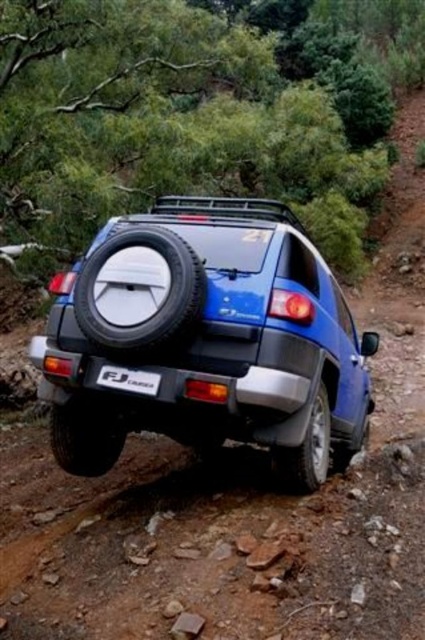
From the picture: Between blue matte suv at center and black rubber tire at lower left, which one is positioned lower?

Positioned lower is black rubber tire at lower left.

Locate an element on the screen. The width and height of the screenshot is (425, 640). blue matte suv at center is located at coordinates (206, 339).

Is point (118, 224) closer to viewer compared to point (96, 412)?

No.

You are a GUI agent. You are given a task and a screenshot of the screen. Output one action in this format:
    pyautogui.click(x=<x>, y=<y>)
    Task: Click on the blue matte suv at center
    
    Given the screenshot: What is the action you would take?
    pyautogui.click(x=206, y=339)

Describe the element at coordinates (85, 436) in the screenshot. I see `black rubber tire at lower left` at that location.

Does black rubber tire at lower left have a greater height compared to black rubber tire at lower right?

In fact, black rubber tire at lower left may be shorter than black rubber tire at lower right.

Where is `black rubber tire at lower left`? The image size is (425, 640). black rubber tire at lower left is located at coordinates (85, 436).

Based on the photo, does black rubber tire at lower right have a greater width compared to black plastic license plate at center?

Correct, the width of black rubber tire at lower right exceeds that of black plastic license plate at center.

Image resolution: width=425 pixels, height=640 pixels. Describe the element at coordinates (306, 451) in the screenshot. I see `black rubber tire at lower right` at that location.

Is point (329, 444) positioned behind point (119, 368)?

Yes, it is behind point (119, 368).

The width and height of the screenshot is (425, 640). Find the location of `black rubber tire at lower right`. black rubber tire at lower right is located at coordinates (306, 451).